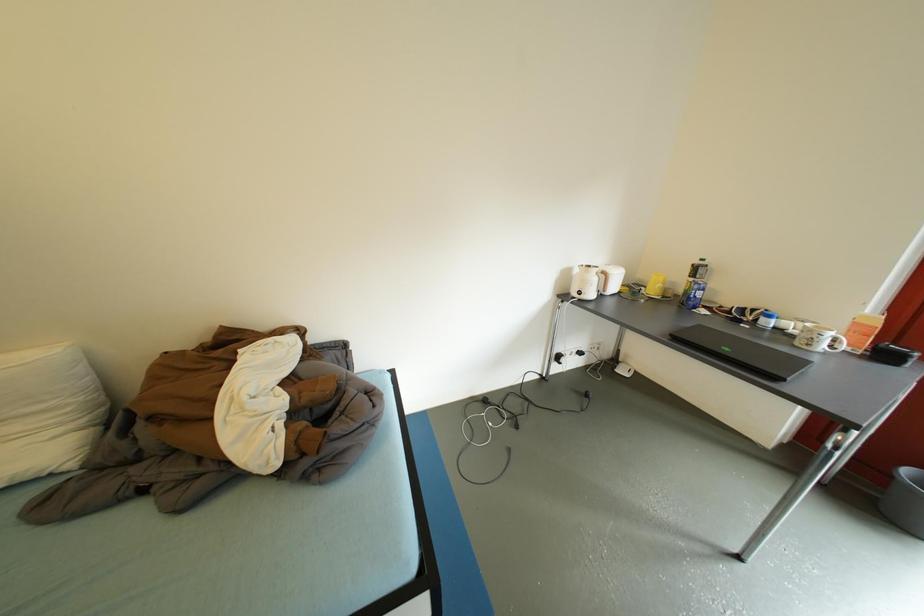
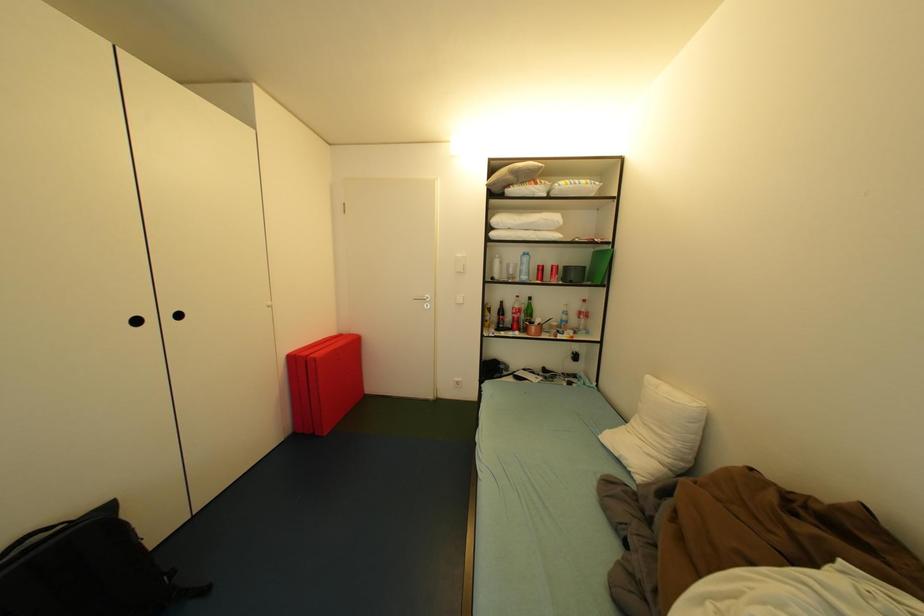
The images are taken continuously from a first-person perspective. In which direction is your viewpoint rotating?

The camera's rotation is toward left-down.